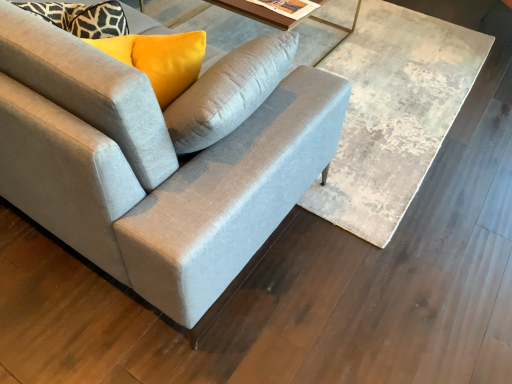
Question: Based on their sizes in the image, would you say suede gray couch at center is bigger or smaller than matte glass table at upper center?

Choices:
 (A) small
 (B) big

Answer: (B)

Question: Based on their positions, is suede gray couch at center located to the left or right of matte glass table at upper center?

Choices:
 (A) left
 (B) right

Answer: (A)

Question: Estimate the real-world distances between objects in this image. Which object is farther from the suede gray couch at center?

Choices:
 (A) wooden textured table at center
 (B) matte glass table at upper center

Answer: (B)

Question: Based on their relative distances, which object is farther from the suede gray couch at center?

Choices:
 (A) matte glass table at upper center
 (B) wooden textured table at center

Answer: (A)